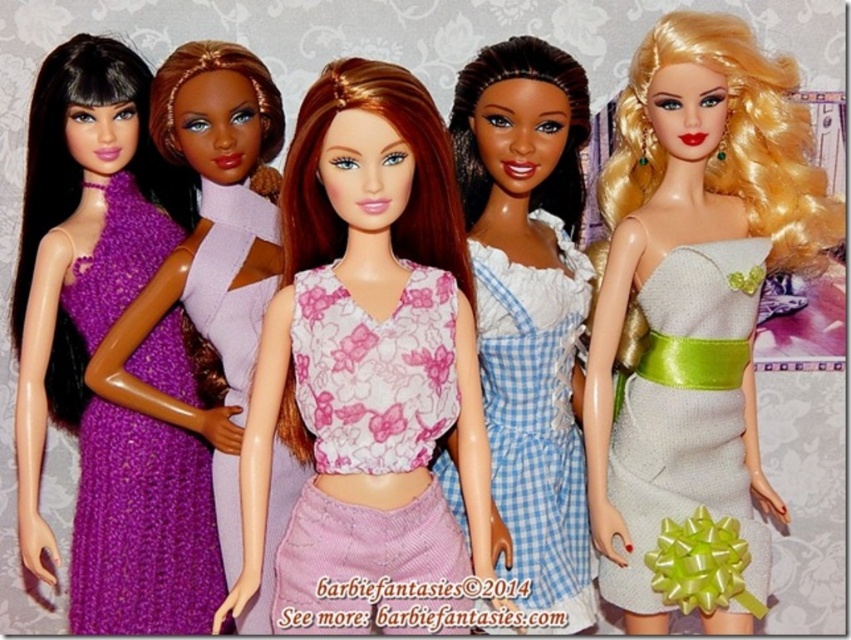
You are standing in front of the dolls and want to touch the point that is closer to you. Which point should you choose between point (466, 272) and point (90, 396)?

Point (466, 272) is closer to the camera than point (90, 396), so you should choose point (466, 272).

You are a collector of dolls and you want to place a new doll exactly at the center of the image. However, there is already a doll wearing a pink floral fabric dress at center. Can you determine if the new doll will overlap with the existing one based on their positions?

The pink floral fabric dress at center is positioned at point (368, 371), which is very close to the center of the image. Therefore, placing a new doll exactly at the center would likely cause an overlap with the existing doll wearing the pink floral fabric dress at center.

You are a child looking at the dolls and want to choose one to play with. You notice two dolls with silver dresses. One has a shiny silver dress at right and the other has a silver sequined dress at center. Which doll is higher up?

The shiny silver dress at right is located above the silver sequined dress at center, so the doll with the shiny silver dress at right is higher up.